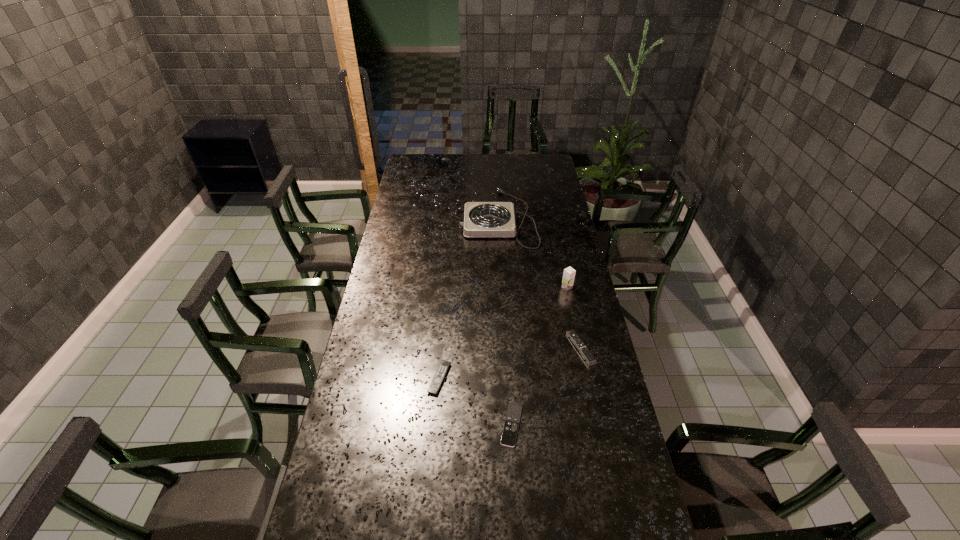
Identify the location of unoccupied area between the tallest object and the shortest remote control. (540, 356).

Image resolution: width=960 pixels, height=540 pixels. In order to click on vacant region between the hotplate and the second farthest object in this screenshot , I will do `click(533, 253)`.

Where is `free space that is in between the third tallest object and the chocolate milk`? free space that is in between the third tallest object and the chocolate milk is located at coordinates (574, 318).

Where is `free space between the tallest object and the second tallest object`? The height and width of the screenshot is (540, 960). free space between the tallest object and the second tallest object is located at coordinates (533, 253).

Choose which object is the fourth nearest neighbor to the hotplate. Please provide its 2D coordinates. Your answer should be formatted as a tuple, i.e. [(x, y)], where the tuple contains the x and y coordinates of a point satisfying the conditions above.

[(509, 434)]

At what (x,y) coordinates should I click in order to perform the action: click on object that is the third closest to the tallest object. Please return your answer as a coordinate pair (x, y). This screenshot has height=540, width=960. Looking at the image, I should click on (509, 434).

The height and width of the screenshot is (540, 960). In order to click on the closest remote control to the tallest remote control in this screenshot , I will do `click(509, 434)`.

Select which remote control appears as the closest to the fourth tallest object. Please provide its 2D coordinates. Your answer should be formatted as a tuple, i.e. [(x, y)], where the tuple contains the x and y coordinates of a point satisfying the conditions above.

[(509, 434)]

This screenshot has height=540, width=960. What are the coordinates of `free point that satisfies the following two spatial constraints: 1. with a retractable cable on the side of the chocolate milk; 2. on the right side of the hotplate` in the screenshot? It's located at (502, 287).

The height and width of the screenshot is (540, 960). Find the location of `vacant space that satisfies the following two spatial constraints: 1. with a retractable cable on the side of the farthest object; 2. on the back side of the tallest remote control`. vacant space that satisfies the following two spatial constraints: 1. with a retractable cable on the side of the farthest object; 2. on the back side of the tallest remote control is located at coordinates (505, 348).